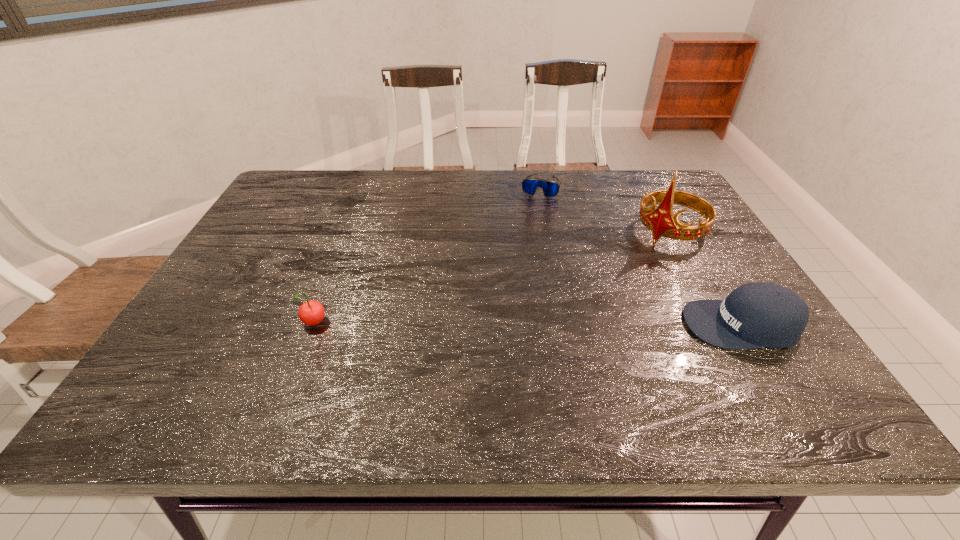
Image resolution: width=960 pixels, height=540 pixels. I want to click on free spot that satisfies the following two spatial constraints: 1. on the front side of the shortest object; 2. on the front-facing side of the baseball cap, so click(x=568, y=325).

The image size is (960, 540). I want to click on free space that satisfies the following two spatial constraints: 1. on the front side of the baseball cap; 2. on the front-facing side of the third nearest object, so pos(720,325).